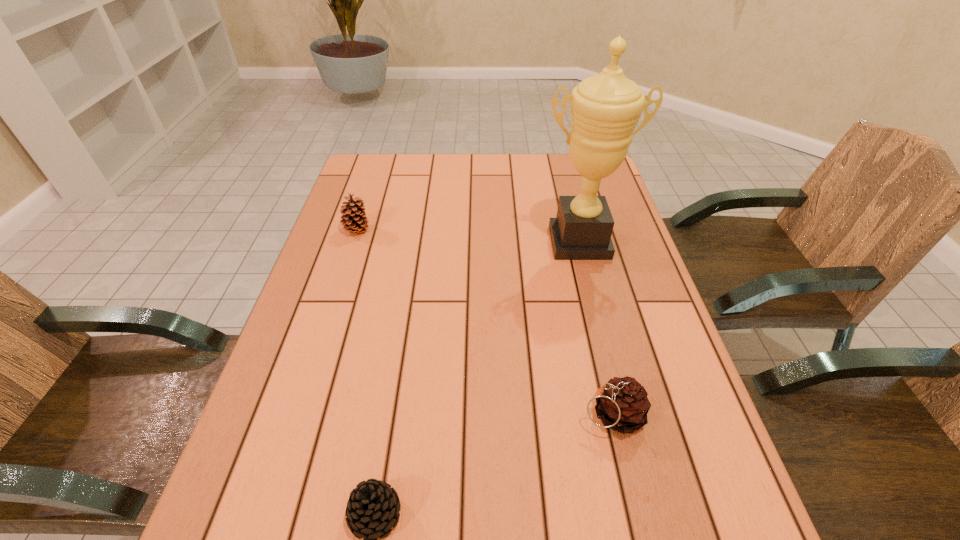
This screenshot has width=960, height=540. Find the location of `object that is at the left edge`. object that is at the left edge is located at coordinates pos(355,221).

You are a GUI agent. You are given a task and a screenshot of the screen. Output one action in this format:
    pyautogui.click(x=<x>, y=<y>)
    Task: Click on the trophy cup at the right edge
    
    Given the screenshot: What is the action you would take?
    pyautogui.click(x=605, y=108)

Where is `pinecone present at the right edge`? The image size is (960, 540). pinecone present at the right edge is located at coordinates (622, 405).

At what (x,y) coordinates should I click in order to perform the action: click on vacant space at the far edge. Please return your answer as a coordinate pair (x, y). Looking at the image, I should click on (522, 189).

Where is `free location at the left edge`? free location at the left edge is located at coordinates (372, 241).

You are a GUI agent. You are given a task and a screenshot of the screen. Output one action in this format:
    pyautogui.click(x=<x>, y=<y>)
    Task: Click on the vacant area at the right edge of the desktop
    The image size is (960, 540).
    Given the screenshot: What is the action you would take?
    pyautogui.click(x=673, y=400)

Image resolution: width=960 pixels, height=540 pixels. In order to click on free spot at the far left corner of the desktop in this screenshot , I will do `click(378, 154)`.

This screenshot has width=960, height=540. I want to click on free space between the trophy cup and the leftmost object, so click(468, 237).

Locate an element on the screen. vacant space that is in between the farthest pinecone and the second farthest pinecone is located at coordinates (485, 322).

Locate an element on the screen. Image resolution: width=960 pixels, height=540 pixels. empty location between the trophy cup and the third farthest object is located at coordinates (595, 328).